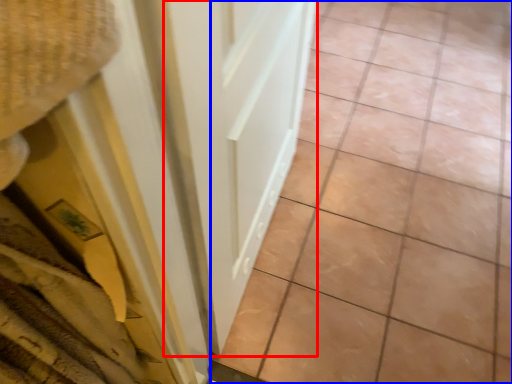
Question: Which object is further to the camera taking this photo, door (highlighted by a red box) or ceramic tile (highlighted by a blue box)?

Choices:
 (A) door
 (B) ceramic tile

Answer: (B)